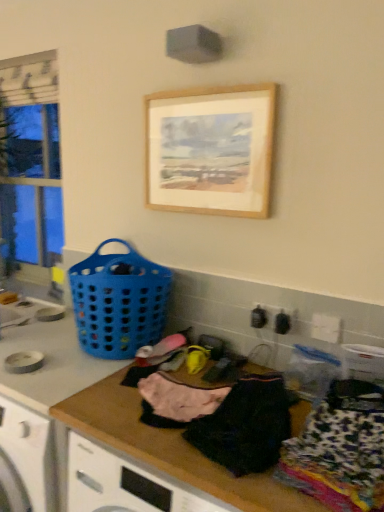
Question: Should I look upward or downward to see pink fabric at center, the third clothing from the right?

Choices:
 (A) up
 (B) down

Answer: (B)

Question: Which direction should I rotate to face black cotton shirt at center, which is counted as the second clothing, starting from the right, — up or down?

Choices:
 (A) up
 (B) down

Answer: (B)

Question: Is blue plastic basket at left outside printed fabric clothing at lower right, marked as the 3th clothing in a left-to-right arrangement?

Choices:
 (A) no
 (B) yes

Answer: (B)

Question: Is the surface of blue plastic basket at left in direct contact with printed fabric clothing at lower right, marked as the 1th clothing in a right-to-left arrangement?

Choices:
 (A) yes
 (B) no

Answer: (B)

Question: Could you tell me if blue plastic basket at left is facing printed fabric clothing at lower right, marked as the 1th clothing in a right-to-left arrangement?

Choices:
 (A) no
 (B) yes

Answer: (A)

Question: Is blue plastic basket at left at the right side of printed fabric clothing at lower right, marked as the 3th clothing in a left-to-right arrangement?

Choices:
 (A) yes
 (B) no

Answer: (B)

Question: Can you confirm if blue plastic basket at left is bigger than printed fabric clothing at lower right, marked as the 1th clothing in a right-to-left arrangement?

Choices:
 (A) no
 (B) yes

Answer: (B)

Question: Considering the relative sizes of blue plastic basket at left and printed fabric clothing at lower right, marked as the 1th clothing in a right-to-left arrangement, in the image provided, is blue plastic basket at left smaller than printed fabric clothing at lower right, marked as the 1th clothing in a right-to-left arrangement,?

Choices:
 (A) no
 (B) yes

Answer: (A)

Question: From a real-world perspective, is black cotton shirt at center, arranged as the second clothing when viewed from the left, located higher than wooden at center?

Choices:
 (A) yes
 (B) no

Answer: (A)

Question: Does black cotton shirt at center, which is counted as the second clothing, starting from the right, have a greater height compared to wooden at center?

Choices:
 (A) no
 (B) yes

Answer: (A)

Question: Is black cotton shirt at center, arranged as the second clothing when viewed from the left, positioned with its back to wooden at center?

Choices:
 (A) no
 (B) yes

Answer: (A)

Question: Does black cotton shirt at center, arranged as the second clothing when viewed from the left, have a smaller size compared to wooden at center?

Choices:
 (A) no
 (B) yes

Answer: (B)

Question: Is black cotton shirt at center, which is counted as the second clothing, starting from the right, to the right of wooden at center from the viewer's perspective?

Choices:
 (A) yes
 (B) no

Answer: (A)

Question: Would you say black cotton shirt at center, arranged as the second clothing when viewed from the left, is outside wooden at center?

Choices:
 (A) no
 (B) yes

Answer: (B)

Question: Considering the relative sizes of clear glass window at left and blue plastic basket at left in the image provided, is clear glass window at left bigger than blue plastic basket at left?

Choices:
 (A) yes
 (B) no

Answer: (A)